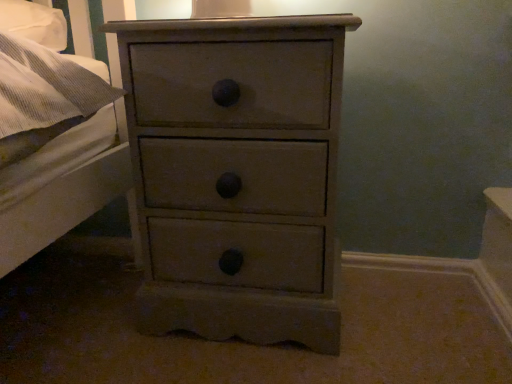
Find the location of a particular element. The image size is (512, 384). unoccupied region to the right of matte gray chest of drawers at center is located at coordinates (408, 325).